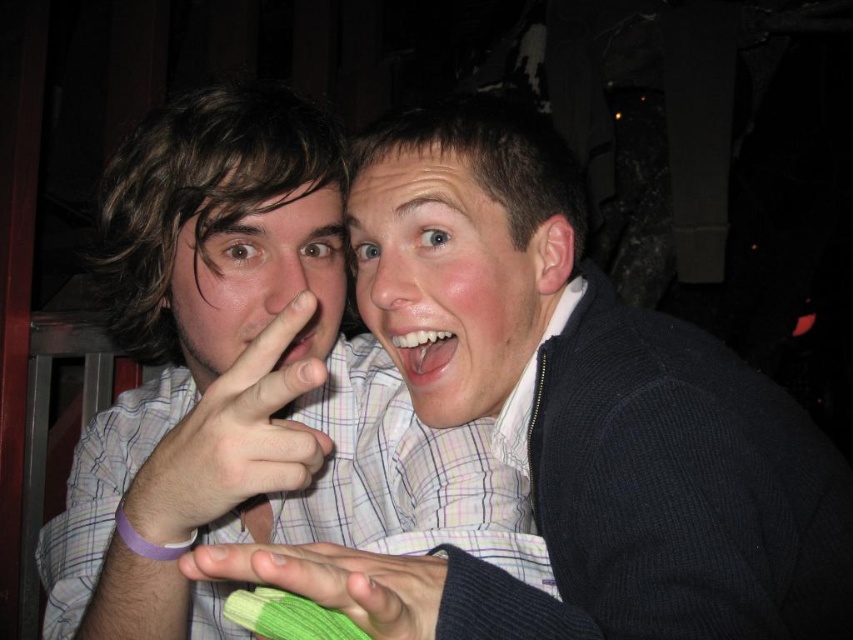
Question: From the image, what is the correct spatial relationship of matte white face at center in relation to green knitted glove at center?

Choices:
 (A) above
 (B) below

Answer: (A)

Question: Estimate the real-world distances between objects in this image. Which object is closer to the matte white face at center?

Choices:
 (A) smooth skin face at center
 (B) white matte hand at center
 (C) pink glossy lips at center
 (D) white glossy teeth at center

Answer: (C)

Question: Can you confirm if white matte hand at center is thinner than green knitted glove at center?

Choices:
 (A) no
 (B) yes

Answer: (A)

Question: Which object is farther from the camera taking this photo?

Choices:
 (A) green knitted glove at center
 (B) white glossy teeth at center
 (C) matte white face at center
 (D) smooth skin face at center

Answer: (C)

Question: Can you confirm if smooth skin face at center is positioned to the left of green knitted glove at center?

Choices:
 (A) yes
 (B) no

Answer: (B)

Question: Which point appears farthest from the camera in this image?

Choices:
 (A) (426, 380)
 (B) (260, 221)
 (C) (454, 188)
 (D) (396, 579)

Answer: (B)